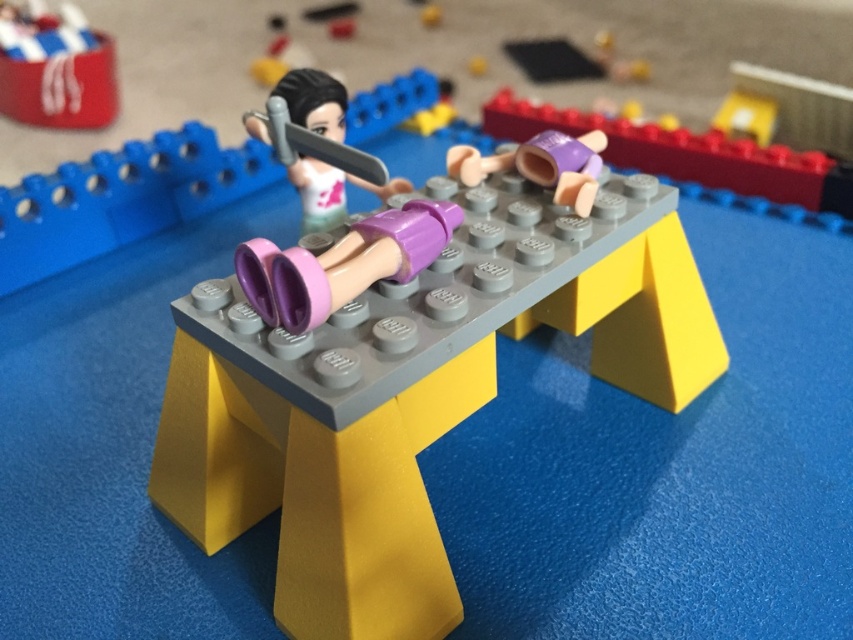
You are setting up a display with the purple plastic doll at center and the matte red can at upper left. Which object should you place first if you want to ensure stability?

The purple plastic doll at center should be placed first because it is taller than the matte red can at upper left, making it more stable to position first.

You are a child who wants to reach the purple plastic doll at center on the LEGO table. The table is 28 inches tall. Can you safely reach the doll without climbing?

The purple plastic doll at center is 30.23 inches from the viewer. Since the table is 28 inches tall, the doll is slightly higher than the table surface. If the child can reach 30.23 inches, they might be able to touch it, but it requires stretching upwards. However, safety depends on the child not overreaching or losing balance.